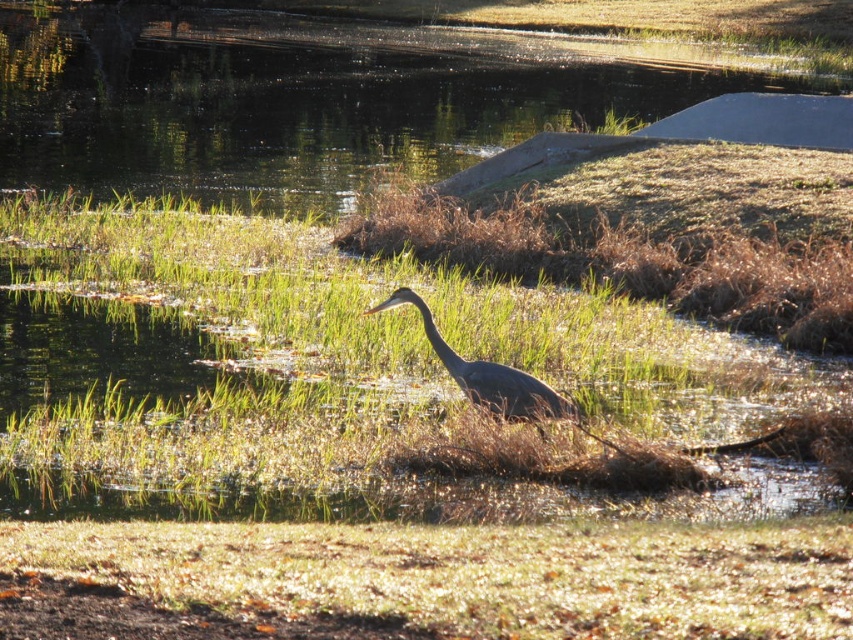
You are a photographer aiming to capture the gray matte heron at center in your shot. You notice the green grass at center is blocking part of the heron. Can you adjust your position to the right to get a clearer view of the heron without the grass obstruction?

The green grass at center is to the left of the gray matte heron at center. By moving to the right, you can position yourself so the heron is no longer obscured by the grass.

In the serene wetland scene, there is green grass at center and clear water at center. Which of these two elements is narrower in width?

The green grass at center is narrower in width than the clear water at center.